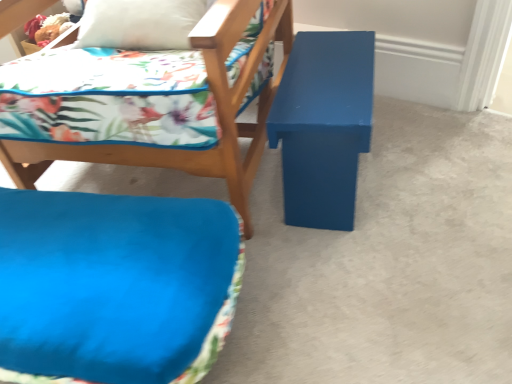
At what (x,y) coordinates should I click in order to perform the action: click on vacant area that lies to the right of matte blue bench at right. Please return your answer as a coordinate pair (x, y). This screenshot has height=384, width=512. Looking at the image, I should click on (430, 159).